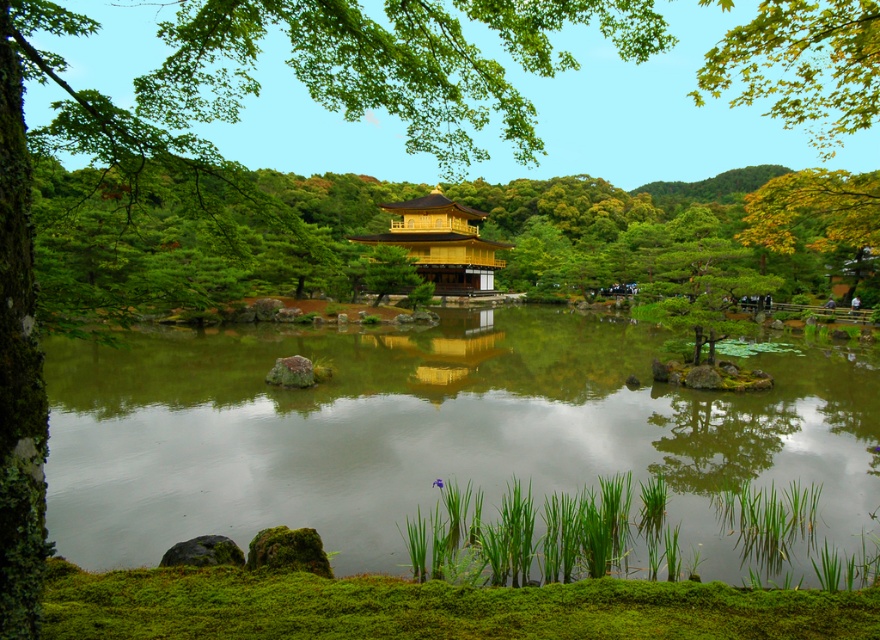
Question: Which object is farther from the camera taking this photo?

Choices:
 (A) gold/reflective/gazebo at center
 (B) green reflective water at center

Answer: (A)

Question: Is green reflective water at center below gold/reflective/gazebo at center?

Choices:
 (A) yes
 (B) no

Answer: (A)

Question: Can you confirm if green reflective water at center is positioned to the right of gold/reflective/gazebo at center?

Choices:
 (A) no
 (B) yes

Answer: (B)

Question: Observing the image, what is the correct spatial positioning of green reflective water at center in reference to gold/reflective/gazebo at center?

Choices:
 (A) left
 (B) right

Answer: (B)

Question: Which point appears closest to the camera in this image?

Choices:
 (A) (368, 353)
 (B) (444, 257)

Answer: (A)